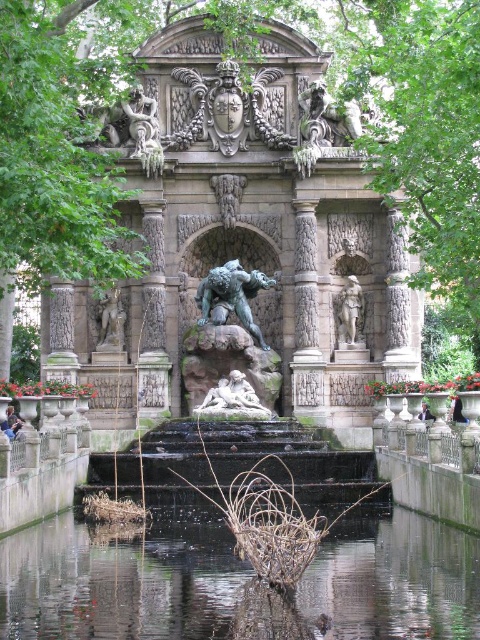
You are a landscape architect designing a pathway between the green stone statue at center and the garden entrance. The pathway must be straight and 1.5 meters wide. Can you fit this pathway between them without any obstacles?

The distance between the green stone statue at center and the garden entrance is 96.40 meters. Since the pathway only needs to be 1.5 meters wide, there is ample space to create a straight, unobstructed path between them.

You are a landscape architect designing a new pathway around the fountain. The pathway must be at least 50 meters away from the polished bronze statue at upper center to avoid disrupting the historical structure. Can the pathway be placed near the clear water at center without violating this requirement?

The clear water at center is 44.61 meters from the polished bronze statue at upper center. Since the required distance is 50 meters, placing the pathway near the clear water at center would be too close to the statue, violating the requirement. Choose a different location farther away.

You are a visitor in the garden and want to take a photo of both the green stone statue at center and the bronze statue of man at center. Which statue should you focus on first to ensure both are in frame without moving the camera?

You should focus on the bronze statue of man at center first because it is shorter than the green stone statue at center, allowing you to frame both within the camera view by positioning the taller statue at the center and adjusting the angle slightly.